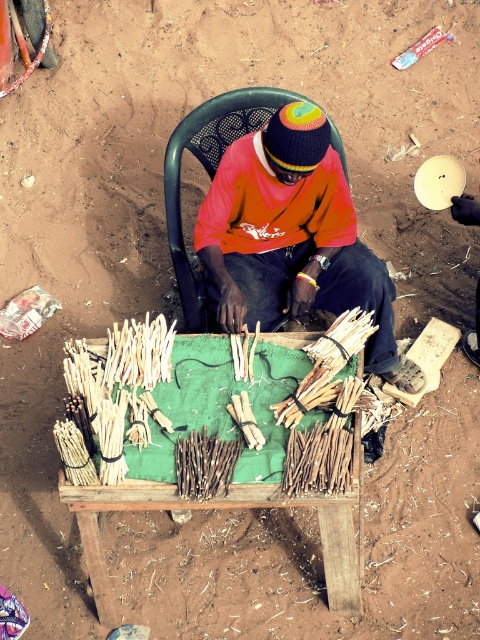
Question: Where is black plastic chair at center located in relation to natural wood reed at left in the image?

Choices:
 (A) right
 (B) left

Answer: (A)

Question: Estimate the real-world distances between objects in this image. Which object is closer to the brown natural reed at center?

Choices:
 (A) brown wood reed at center
 (B) bamboo sticks at center
 (C) orange cotton shirt at center
 (D) natural wood reed at left

Answer: (A)

Question: Can you confirm if natural wood reed at left is smaller than brown wood reed at center?

Choices:
 (A) yes
 (B) no

Answer: (B)

Question: Estimate the real-world distances between objects in this image. Which object is closer to the brown wood reed at center?

Choices:
 (A) black plastic chair at center
 (B) wooden sticks at center
 (C) bamboo sticks at center

Answer: (B)

Question: Is orange cotton shirt at center above brown natural reed at center?

Choices:
 (A) no
 (B) yes

Answer: (B)

Question: Which point is farther to the camera?

Choices:
 (A) (268, 109)
 (B) (252, 132)
 (C) (289, 419)
 (D) (350, 451)

Answer: (A)